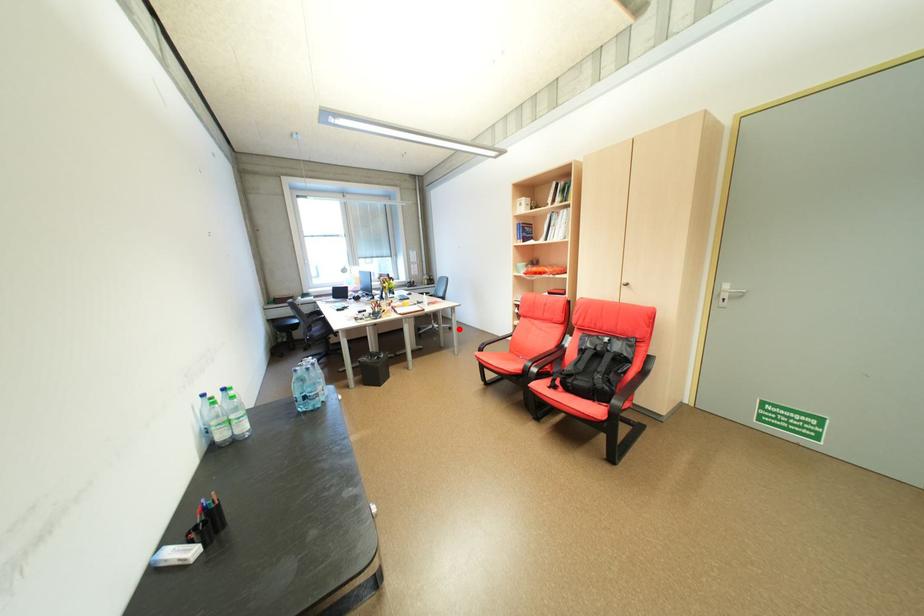
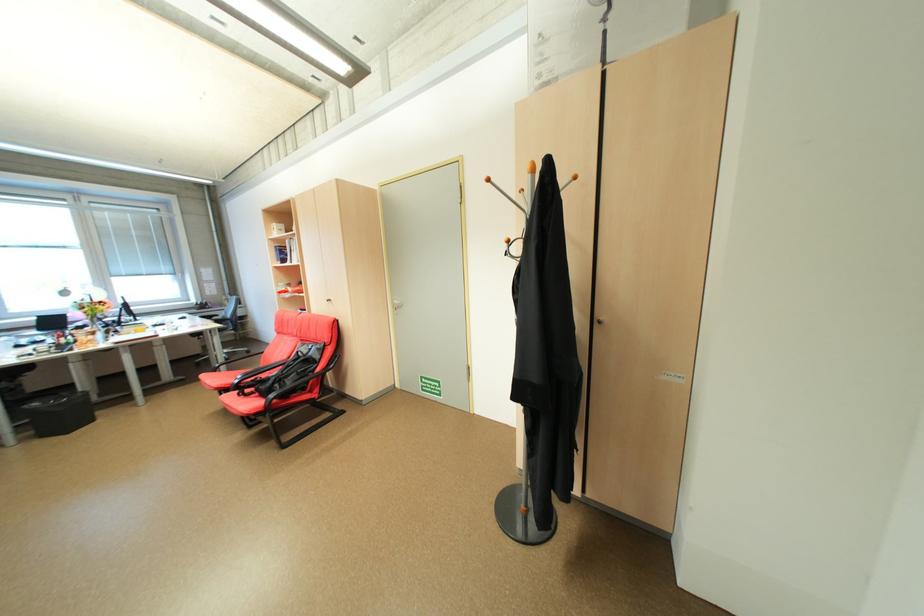
Question: A red point is marked in image1. In image2, is the corresponding 3D point closer to the camera or farther? Reply with the corresponding letter.

Choices:
 (A) The corresponding 3D point is closer.
 (B) The corresponding 3D point is farther.

Answer: (B)